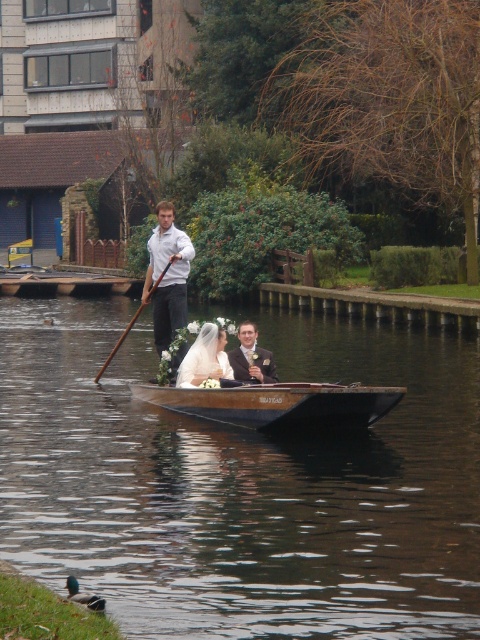
Question: Which of the following is the farthest from the observer?

Choices:
 (A) matte black suit at center
 (B) brown wooden paddle at center
 (C) brown wooden canoe at center

Answer: (B)

Question: Which of the following is the closest to the observer?

Choices:
 (A) coord(149,273)
 (B) coord(111,356)
 (C) coord(289,404)
 (D) coord(182,374)

Answer: (C)

Question: Among these points, which one is nearest to the camera?

Choices:
 (A) (182, 316)
 (B) (130, 326)

Answer: (A)

Question: Is brown wooden boat at center in front of brown wooden paddle at center?

Choices:
 (A) no
 (B) yes

Answer: (B)

Question: Is brown wooden boat at center below matte white dress at center?

Choices:
 (A) no
 (B) yes

Answer: (B)

Question: Considering the relative positions of brown wooden canoe at center and matte black suit at center in the image provided, where is brown wooden canoe at center located with respect to matte black suit at center?

Choices:
 (A) left
 (B) right

Answer: (A)